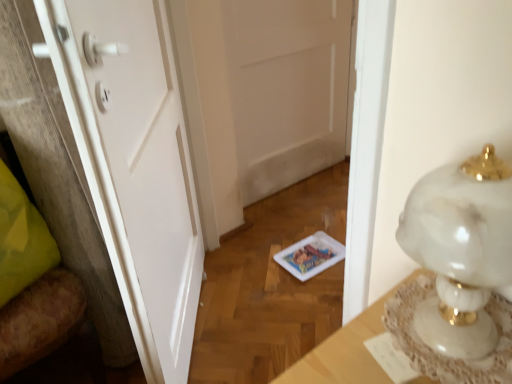
Image resolution: width=512 pixels, height=384 pixels. I want to click on blank space situated above white marble table at right (from a real-world perspective), so click(445, 329).